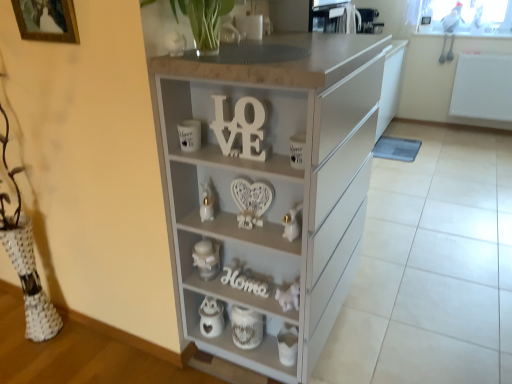
Question: From the image's perspective, does white textured ceramic jar at lower center appear lower than white glossy rabbit at center, placed as the 2th toy when sorted from right to left?

Choices:
 (A) no
 (B) yes

Answer: (B)

Question: Does white textured ceramic jar at lower center come behind white glossy rabbit at center, which appears as the first toy when viewed from the left?

Choices:
 (A) no
 (B) yes

Answer: (B)

Question: Does white textured ceramic jar at lower center appear on the left side of white glossy rabbit at center, placed as the 2th toy when sorted from right to left?

Choices:
 (A) yes
 (B) no

Answer: (B)

Question: Considering the relative sizes of white textured ceramic jar at lower center and white glossy rabbit at center, placed as the 2th toy when sorted from right to left, in the image provided, is white textured ceramic jar at lower center smaller than white glossy rabbit at center, placed as the 2th toy when sorted from right to left,?

Choices:
 (A) yes
 (B) no

Answer: (B)

Question: Can you confirm if white textured ceramic jar at lower center is positioned to the right of white glossy rabbit at center, acting as the second toy starting from the front?

Choices:
 (A) no
 (B) yes

Answer: (B)

Question: Looking at their shapes, would you say white glossy owl at lower center, acting as the second appliance starting from the back, is wider or thinner than wooden letters at center, which appears as the 1th alphabet when viewed from the front?

Choices:
 (A) thin
 (B) wide

Answer: (B)

Question: From a real-world perspective, relative to wooden letters at center, arranged as the 1th alphabet when viewed from the top, is white glossy owl at lower center, the first appliance positioned from the bottom, vertically above or below?

Choices:
 (A) below
 (B) above

Answer: (A)

Question: Is white glossy owl at lower center, acting as the 2th appliance starting from the front, bigger or smaller than wooden letters at center, arranged as the 1th alphabet when viewed from the top?

Choices:
 (A) big
 (B) small

Answer: (B)

Question: Considering the positions of white glossy owl at lower center, the 2th appliance viewed from the left, and wooden letters at center, arranged as the 1th alphabet when viewed from the top, in the image, is white glossy owl at lower center, the 2th appliance viewed from the left, taller or shorter than wooden letters at center, arranged as the 1th alphabet when viewed from the top,?

Choices:
 (A) tall
 (B) short

Answer: (B)

Question: Does point (224, 307) appear closer or farther from the camera than point (182, 127)?

Choices:
 (A) closer
 (B) farther

Answer: (B)

Question: Considering the positions of white textured ceramic jar at lower center and white glossy mug at upper center, which ranks as the third appliance in back-to-front order, in the image, is white textured ceramic jar at lower center bigger or smaller than white glossy mug at upper center, which ranks as the third appliance in back-to-front order,?

Choices:
 (A) big
 (B) small

Answer: (A)

Question: Relative to white glossy mug at upper center, marked as the first appliance in a front-to-back arrangement, is white textured ceramic jar at lower center in front or behind?

Choices:
 (A) front
 (B) behind

Answer: (B)

Question: From their relative heights in the image, would you say white textured ceramic jar at lower center is taller or shorter than white glossy mug at upper center, marked as the first appliance in a front-to-back arrangement?

Choices:
 (A) short
 (B) tall

Answer: (B)

Question: Is white glossy rabbit at lower center, the second toy in the back-to-front sequence, inside the boundaries of white glossy rabbit at center, placed as the 2th toy when sorted from right to left, or outside?

Choices:
 (A) outside
 (B) inside

Answer: (A)

Question: Is white glossy rabbit at lower center, the first toy from the right, wider or thinner than white glossy rabbit at center, acting as the second toy starting from the front?

Choices:
 (A) thin
 (B) wide

Answer: (B)